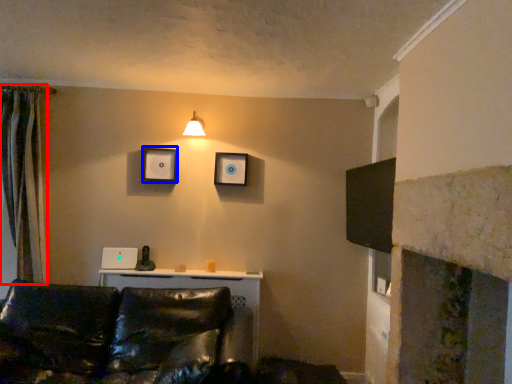
Question: Which point is closer to the camera, curtain (highlighted by a red box) or picture frame (highlighted by a blue box)?

Choices:
 (A) curtain
 (B) picture frame

Answer: (A)